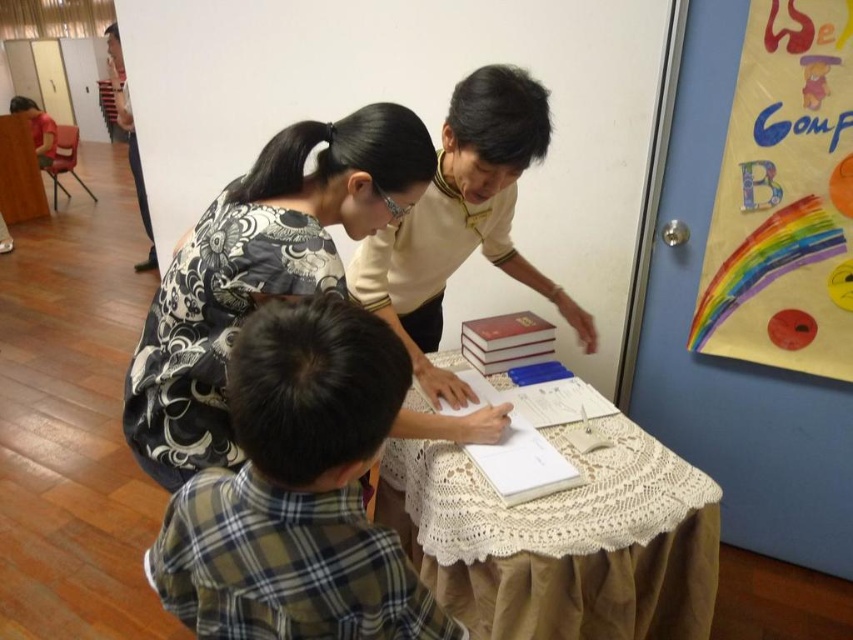
Question: Which is nearer to the hardcover book at center?

Choices:
 (A) white lace tablecloth at center
 (B) brown plaid shirt at lower center
 (C) matte black shirt at upper left
 (D) matte yellow sweater at upper center

Answer: (D)

Question: Which of the following is the farthest from the observer?

Choices:
 (A) patterned fabric blouse at center
 (B) brown plaid shirt at lower center
 (C) matte black shirt at upper left
 (D) hardcover book at center

Answer: (C)

Question: Is white lace tablecloth at center positioned behind patterned fabric blouse at center?

Choices:
 (A) no
 (B) yes

Answer: (B)

Question: Which point is closer to the camera?

Choices:
 (A) (126, 124)
 (B) (518, 339)

Answer: (B)

Question: In this image, where is patterned fabric blouse at center located relative to matte yellow sweater at upper center?

Choices:
 (A) below
 (B) above

Answer: (A)

Question: Observing the image, what is the correct spatial positioning of patterned fabric blouse at center in reference to matte yellow sweater at upper center?

Choices:
 (A) above
 (B) below

Answer: (B)